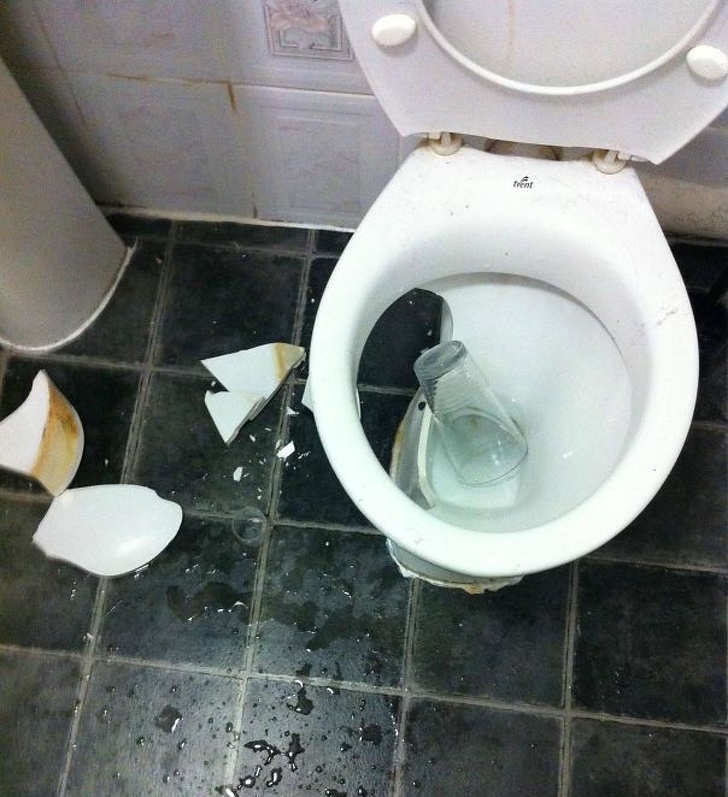
The width and height of the screenshot is (728, 797). Identify the location of toilet seat. (416, 88).